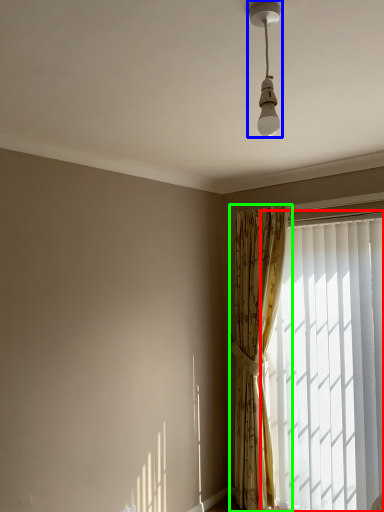
Question: Based on their relative distances, which object is farther from window (highlighted by a red box)? Choose from lamp (highlighted by a blue box) and curtain (highlighted by a green box).

Choices:
 (A) lamp
 (B) curtain

Answer: (A)